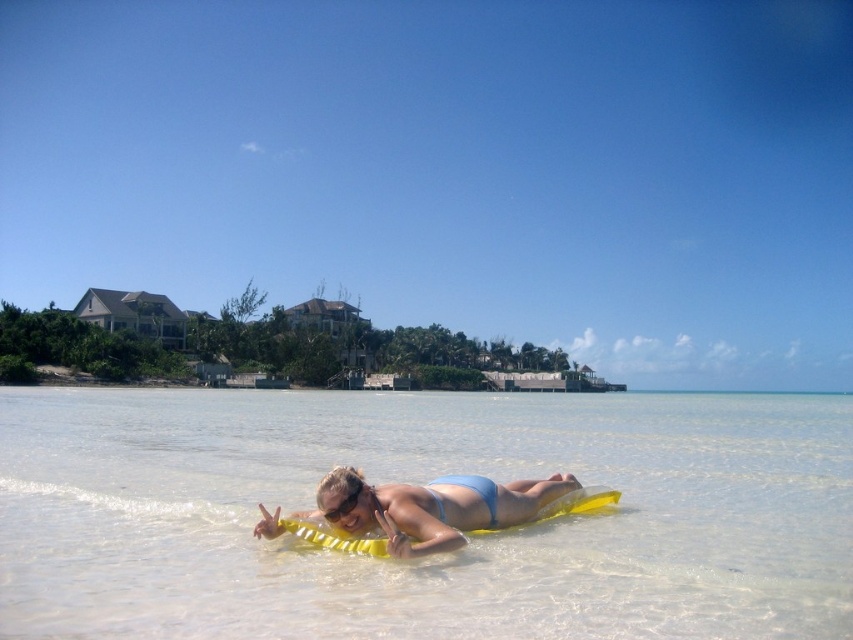
You are standing on the beach and want to reach both the point at coordinates point (437, 513) and point (427, 484). Which point should you head towards first to minimize the distance walked?

You should head towards point (437, 513) first because it is closer to you than point (427, 484).

You are a photographer trying to capture the perfect shot of the clear water at center and the blue matte bikini top at center. Based on their positions, which object should you focus on first if you want to frame them both in the same shot?

The clear water at center is positioned on the left side of blue matte bikini top at center, so you should focus on the clear water at center first to ensure both objects are in frame.